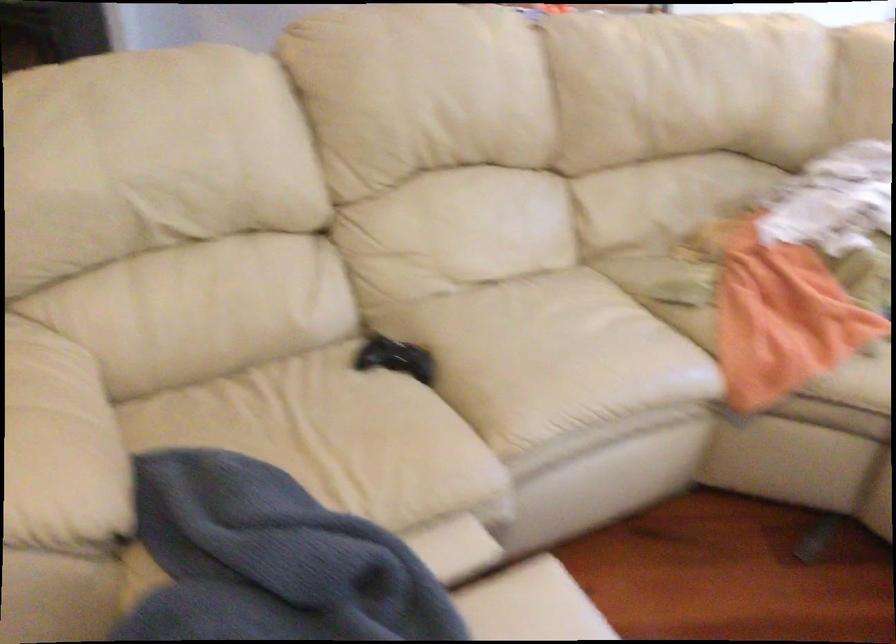
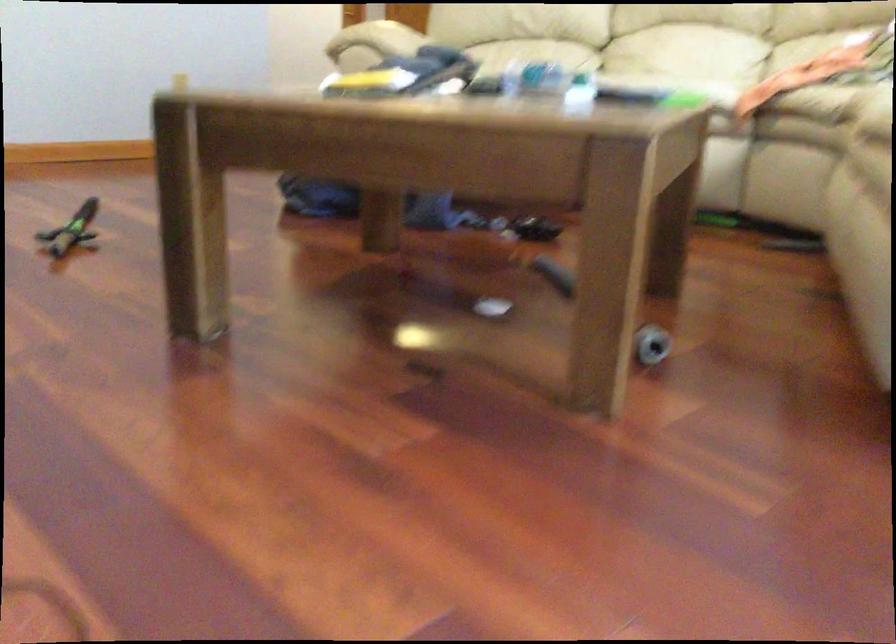
In the second image, find the point that corresponds to (484,232) in the first image.

(686, 59)